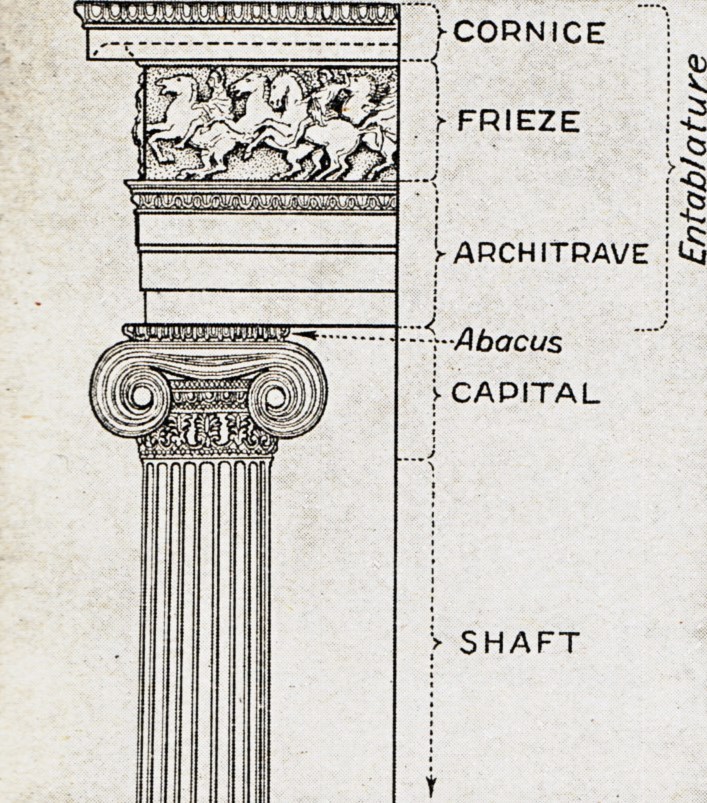
This screenshot has width=707, height=803. Find the location of `frieze`. frieze is located at coordinates (539, 129).